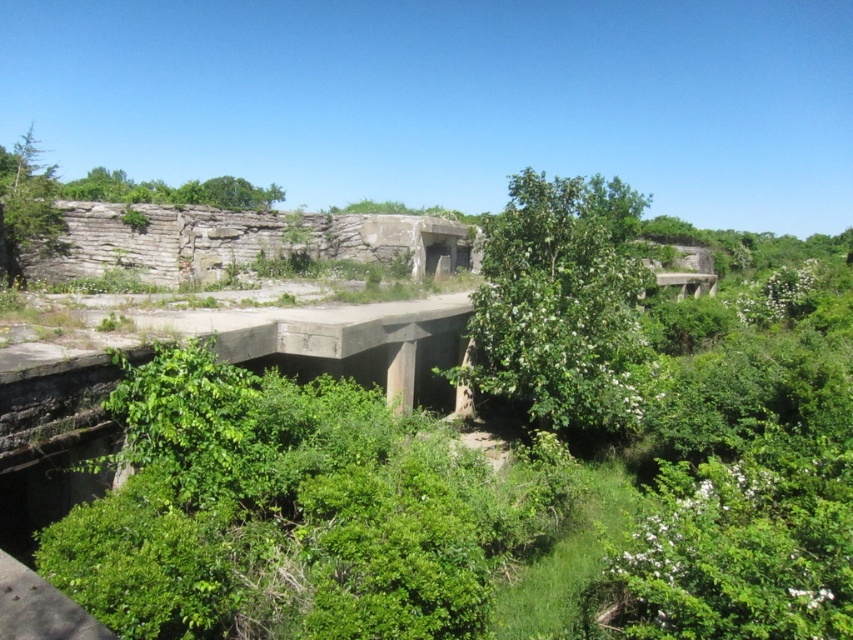
Measure the distance between green leafy tree at center and camera.

green leafy tree at center is 54.64 feet away from camera.

Measure the distance between point (584,184) and camera.

Point (584,184) is 20.20 meters from camera.

Locate an element on the screen. green leafy tree at center is located at coordinates (561, 307).